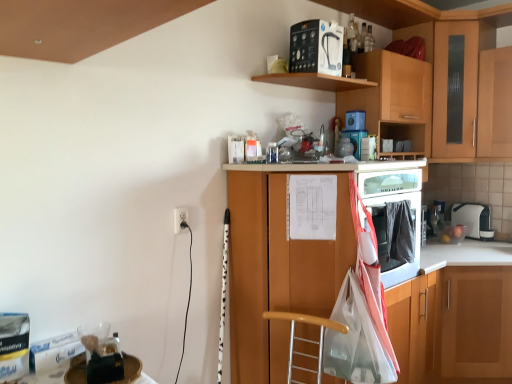
Question: Could you tell me if blue plastic container at upper center, the 3th appliance positioned from the right, is facing white plastic toaster at upper right, the 1th appliance when ordered from back to front?

Choices:
 (A) no
 (B) yes

Answer: (A)

Question: Considering the relative sizes of blue plastic container at upper center, which ranks as the 3th appliance in bottom-to-top order, and white plastic toaster at upper right, which appears as the first appliance when viewed from the right, in the image provided, is blue plastic container at upper center, which ranks as the 3th appliance in bottom-to-top order, wider than white plastic toaster at upper right, which appears as the first appliance when viewed from the right,?

Choices:
 (A) yes
 (B) no

Answer: (B)

Question: Can you confirm if blue plastic container at upper center, the 3th appliance positioned from the right, is shorter than white plastic toaster at upper right, positioned as the 4th appliance in left-to-right order?

Choices:
 (A) no
 (B) yes

Answer: (B)

Question: Is blue plastic container at upper center, the 2th appliance in the left-to-right sequence, positioned with its back to white plastic toaster at upper right, positioned as the fourth appliance in front-to-back order?

Choices:
 (A) no
 (B) yes

Answer: (A)

Question: Does blue plastic container at upper center, the 2th appliance in the left-to-right sequence, lie behind white plastic toaster at upper right, acting as the fourth appliance starting from the top?

Choices:
 (A) yes
 (B) no

Answer: (B)

Question: Is wooden cabinet at upper right, the 2th cabinetry in the left-to-right sequence, to the left or to the right of white glossy counter at lower right in the image?

Choices:
 (A) left
 (B) right

Answer: (A)

Question: Does point (398, 66) appear closer or farther from the camera than point (464, 352)?

Choices:
 (A) farther
 (B) closer

Answer: (B)

Question: From the image's perspective, relative to white glossy counter at lower right, is wooden cabinet at upper right, marked as the third cabinetry in a right-to-left arrangement, above or below?

Choices:
 (A) above
 (B) below

Answer: (A)

Question: In terms of size, does wooden cabinet at upper right, marked as the third cabinetry in a right-to-left arrangement, appear bigger or smaller than white glossy counter at lower right?

Choices:
 (A) small
 (B) big

Answer: (A)

Question: Considering their positions, is wooden cabinet at center, positioned as the 1th cabinetry in left-to-right order, located in front of or behind blue plastic container at upper center, the 3th appliance positioned from the right?

Choices:
 (A) behind
 (B) front

Answer: (B)

Question: From a real-world perspective, relative to blue plastic container at upper center, which ranks as the 2th appliance in back-to-front order, is wooden cabinet at center, the fourth cabinetry in the right-to-left sequence, vertically above or below?

Choices:
 (A) below
 (B) above

Answer: (A)

Question: From the image's perspective, relative to blue plastic container at upper center, which ranks as the 3th appliance in bottom-to-top order, is wooden cabinet at center, positioned as the 1th cabinetry in left-to-right order, above or below?

Choices:
 (A) above
 (B) below

Answer: (B)

Question: Looking at their shapes, would you say wooden cabinet at center, positioned as the 1th cabinetry in left-to-right order, is wider or thinner than blue plastic container at upper center, which ranks as the 3th appliance in bottom-to-top order?

Choices:
 (A) wide
 (B) thin

Answer: (A)

Question: From a real-world perspective, is wooden cabinet at upper right, marked as the third cabinetry in a right-to-left arrangement, above or below white matte water filter at upper center, which ranks as the 4th appliance in right-to-left order?

Choices:
 (A) below
 (B) above

Answer: (A)

Question: Is wooden cabinet at upper right, marked as the third cabinetry in a right-to-left arrangement, in front of or behind white matte water filter at upper center, which appears as the 4th appliance when ordered from the bottom, in the image?

Choices:
 (A) front
 (B) behind

Answer: (B)